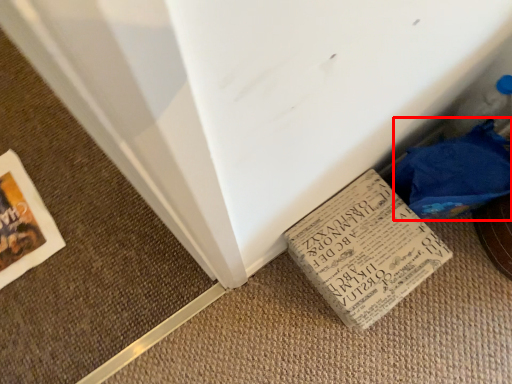
Question: From the image, what is the correct spatial relationship of material (annotated by the red box) in relation to book?

Choices:
 (A) left
 (B) right

Answer: (B)